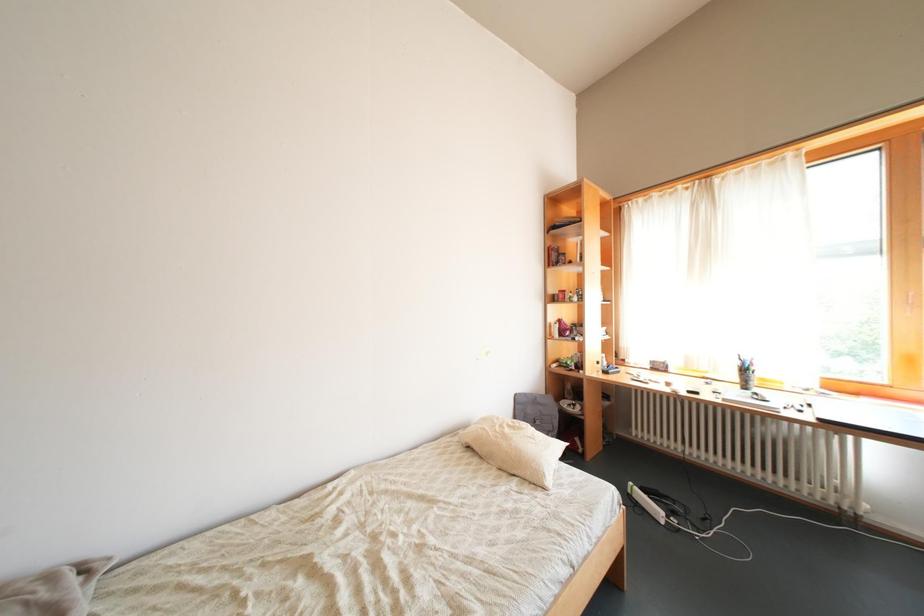
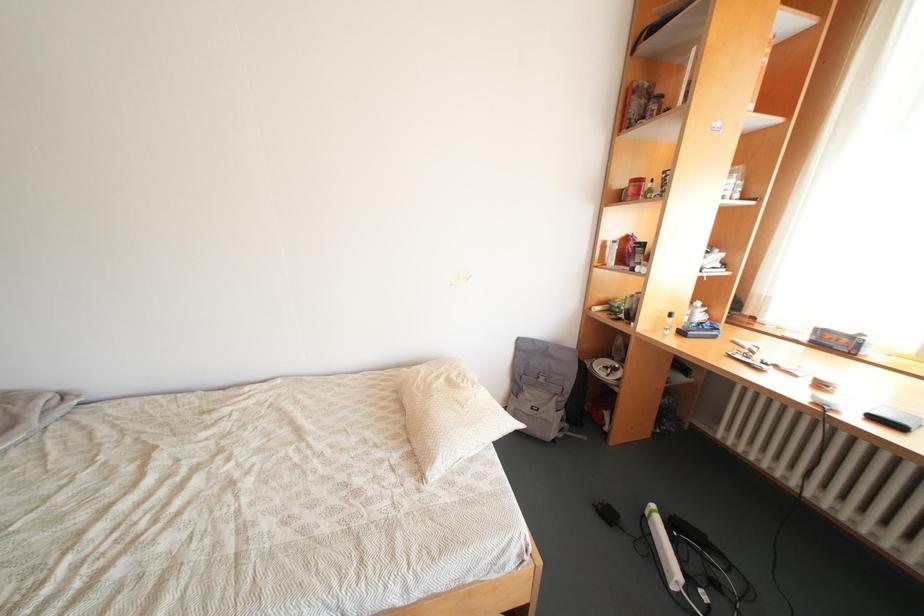
First-person continuous shooting, in which direction is the camera rotating?

The camera's rotation is toward left-down.